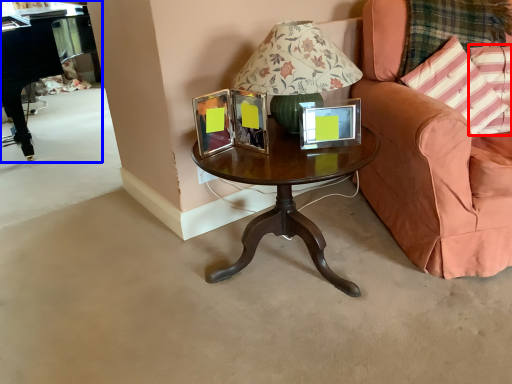
Question: Which point is further to the camera, pillow (highlighted by a red box) or piano (highlighted by a blue box)?

Choices:
 (A) pillow
 (B) piano

Answer: (B)